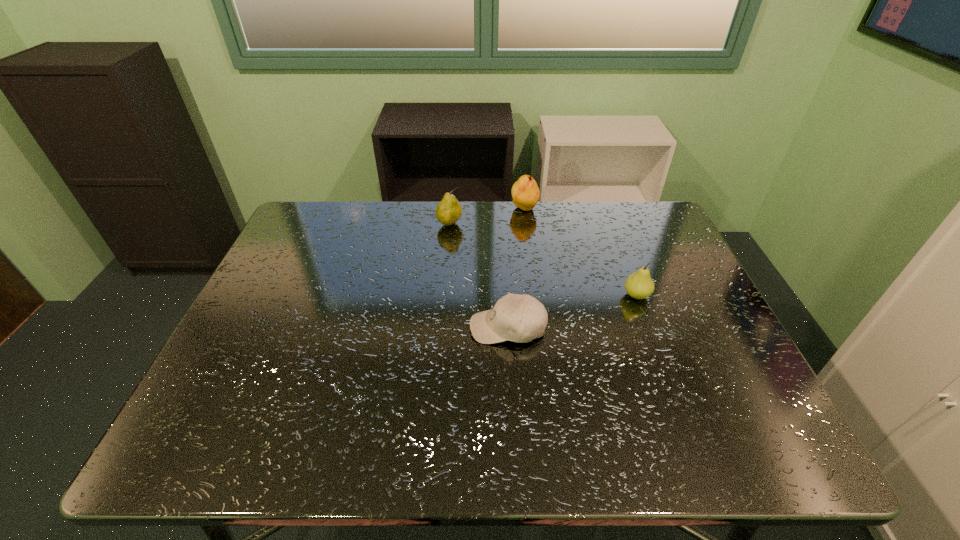
The width and height of the screenshot is (960, 540). Find the location of `vacant space in between the leftmost object and the baseball cap`. vacant space in between the leftmost object and the baseball cap is located at coordinates (479, 276).

What are the coordinates of `vacant space in between the farthest object and the baseball cap` in the screenshot? It's located at (516, 268).

Identify which object is located as the nearest to the baseball cap. Please provide its 2D coordinates. Your answer should be formatted as a tuple, i.e. [(x, y)], where the tuple contains the x and y coordinates of a point satisfying the conditions above.

[(639, 285)]

Locate which object ranks in proximity to the second pear from left to right. Please provide its 2D coordinates. Your answer should be formatted as a tuple, i.e. [(x, y)], where the tuple contains the x and y coordinates of a point satisfying the conditions above.

[(448, 211)]

Image resolution: width=960 pixels, height=540 pixels. Identify the location of pear that is the second closest to the rightmost pear. [x=448, y=211].

Image resolution: width=960 pixels, height=540 pixels. I want to click on pear that is the third closest one to the shortest object, so (525, 193).

I want to click on free region that satisfies the following two spatial constraints: 1. on the front side of the second nearest object; 2. on the right side of the leftmost object, so click(x=444, y=295).